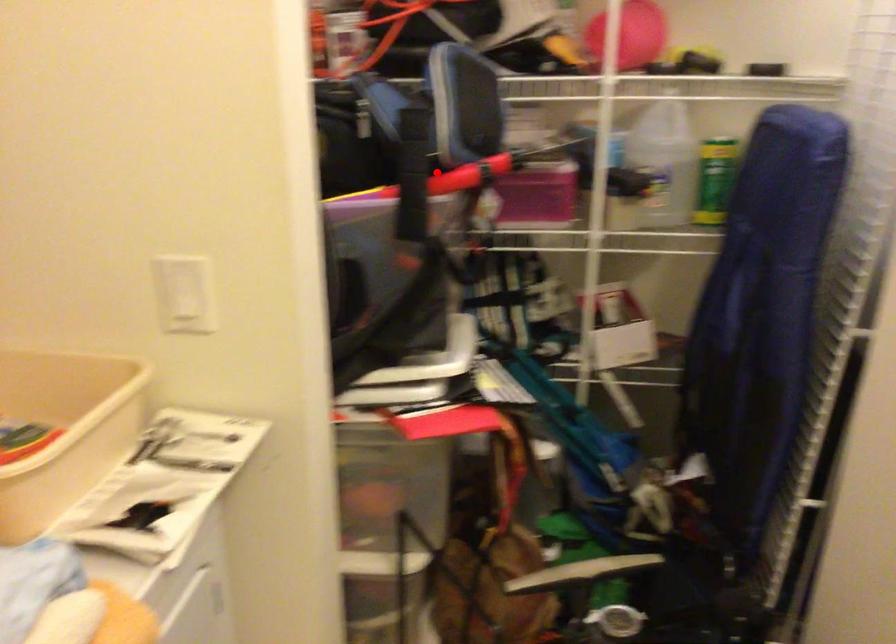
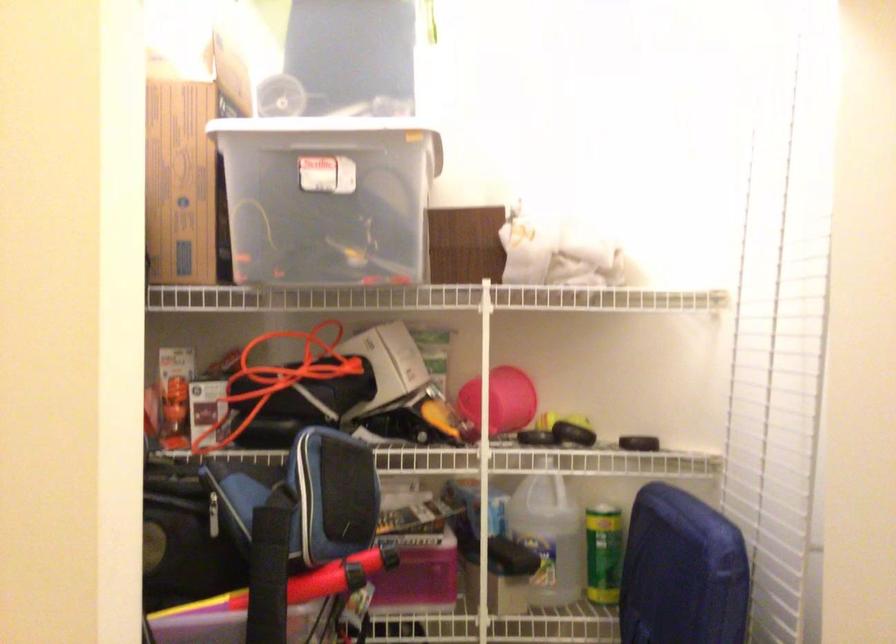
Locate, in the second image, the point that corresponds to the highlighted location in the first image.

(298, 583)